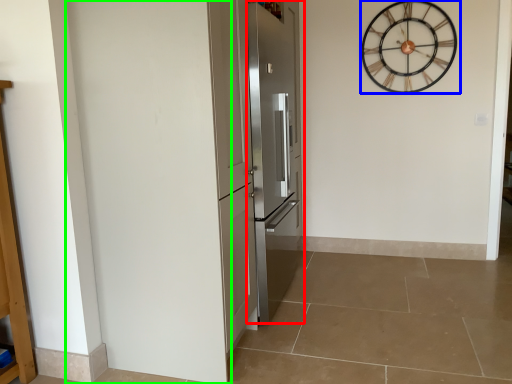
Question: Based on their relative distances, which object is farther from door (highlighted by a red box)? Choose from wall clock (highlighted by a blue box) and door (highlighted by a green box).

Choices:
 (A) wall clock
 (B) door

Answer: (A)